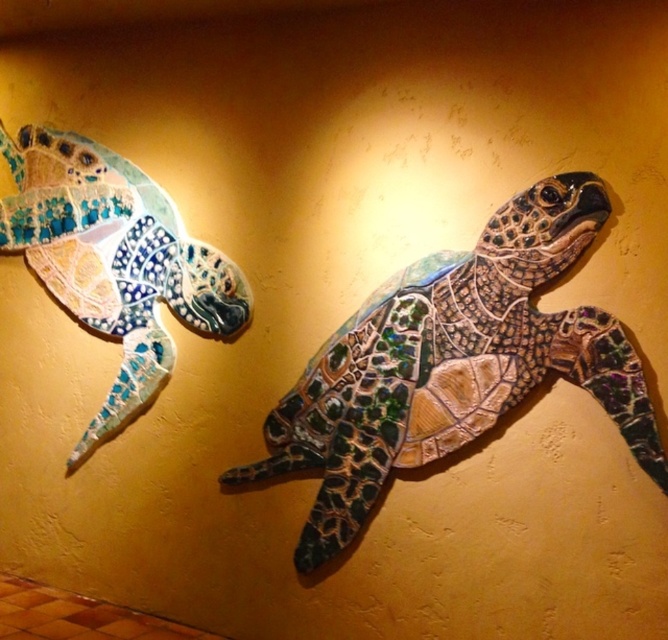
You are an art installer who needs to ensure that the shiny mosaic turtle at center and the shiny mosaic turtle at left are displayed at the correct height. According to the scene description, which turtle should be placed lower to maintain proper alignment?

The shiny mosaic turtle at center is shorter than the shiny mosaic turtle at left, so to maintain proper alignment, the shiny mosaic turtle at center should be placed lower than the shiny mosaic turtle at left.

You are an art installer standing at the origin point of the wall. You need to place a new sculpture exactly 0.3 units to the right and 0.2 units above the shiny mosaic turtle at center. What are the coordinates where you should place the new sculpture?

The shiny mosaic turtle at center is located at point (452, 364). Adding 0.3 to the x coordinate and 0.2 to the y coordinate gives 0.569 0.3 0.678 0.2 0.869 0.878. So the new coordinates are (586, 556).